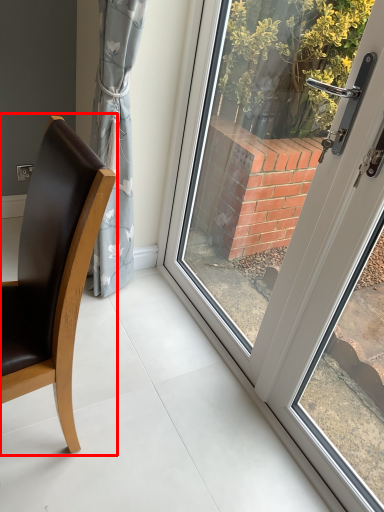
Question: From the image's perspective, considering the relative positions of chair (annotated by the red box) and door in the image provided, where is chair (annotated by the red box) located with respect to the staircase?

Choices:
 (A) above
 (B) below

Answer: (B)